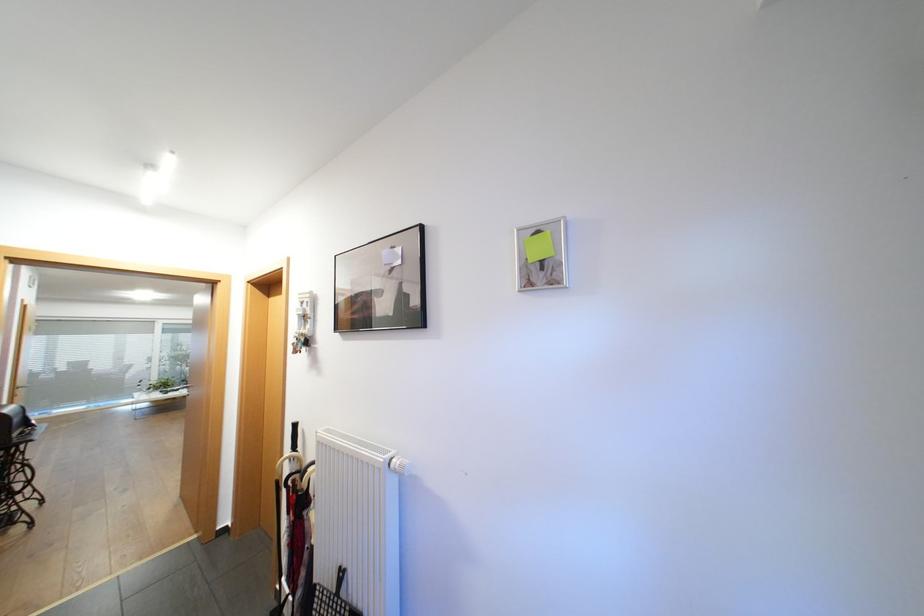
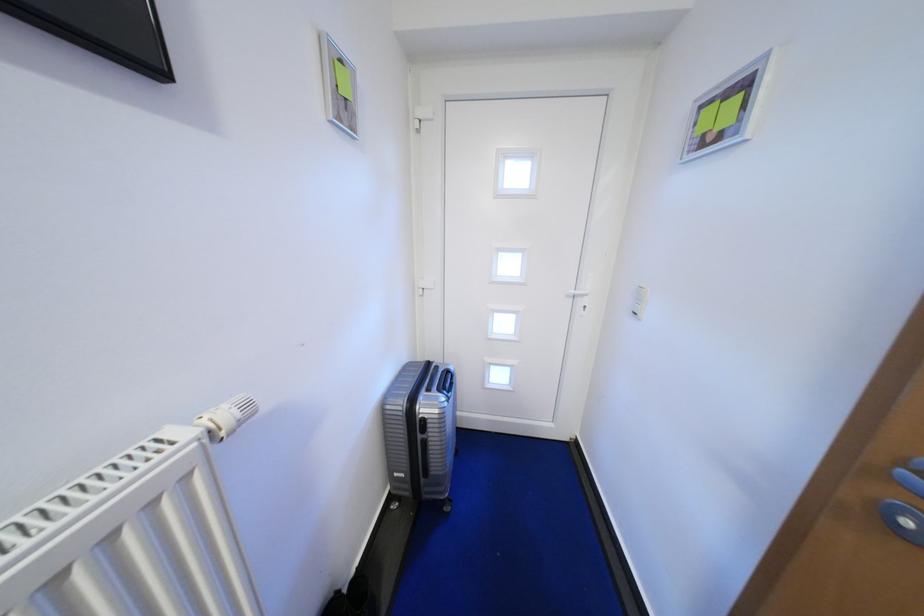
The point at (x=403, y=467) is marked in the first image. Where is the corresponding point in the second image?

(245, 416)